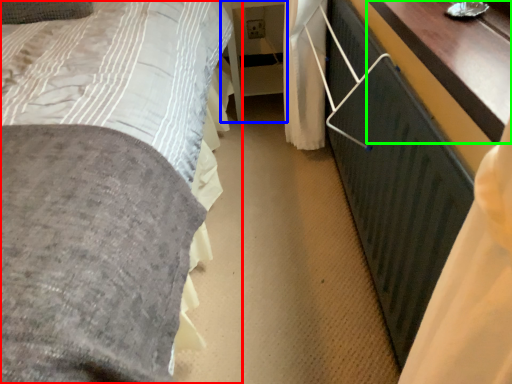
Question: Estimate the real-world distances between objects in this image. Which object is farther from bed (highlighted by a red box), table (highlighted by a blue box) or table (highlighted by a green box)?

Choices:
 (A) table
 (B) table

Answer: (A)